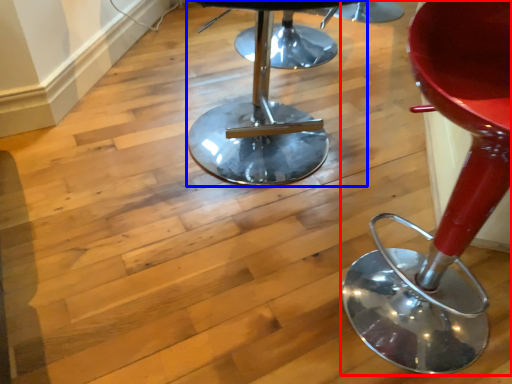
Question: Which point is closer to the camera, chair (highlighted by a red box) or stool (highlighted by a blue box)?

Choices:
 (A) chair
 (B) stool

Answer: (A)